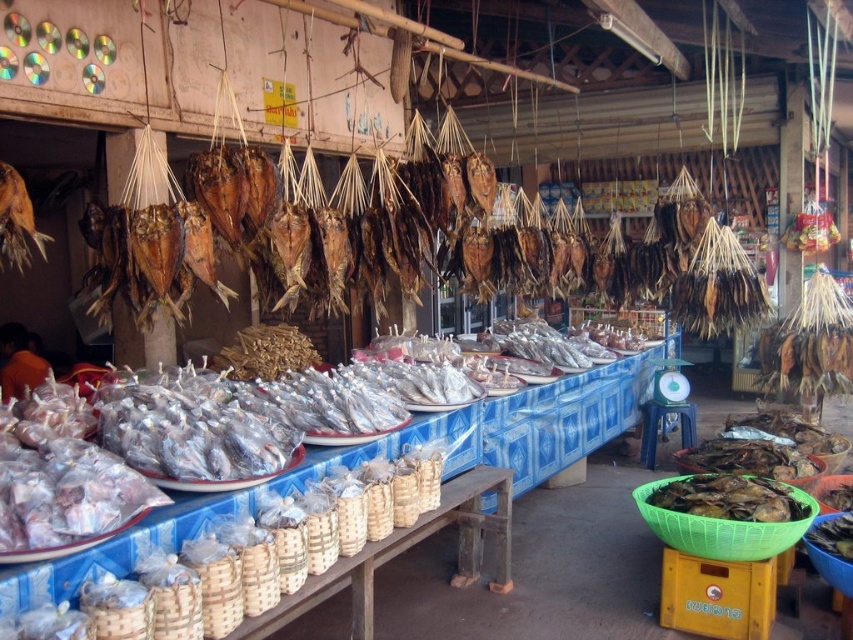
Question: Which point is farther to the camera?

Choices:
 (A) brown dried fish at center
 (B) blue woven baskets at center
 (C) green woven basket at lower right

Answer: (B)

Question: Does brown dried fish at center appear on the right side of blue woven baskets at center?

Choices:
 (A) no
 (B) yes

Answer: (A)

Question: Is blue woven baskets at center smaller than green woven basket at lower right?

Choices:
 (A) yes
 (B) no

Answer: (B)

Question: Which object is positioned closest to the blue woven baskets at center?

Choices:
 (A) green woven basket at lower right
 (B) brown dried fish at center
 (C) brown matte dried fish at lower right

Answer: (B)

Question: Does brown matte dried fish at lower right have a lesser width compared to green woven basket at lower right?

Choices:
 (A) no
 (B) yes

Answer: (A)

Question: Which object appears farthest from the camera in this image?

Choices:
 (A) brown matte dried fish at lower right
 (B) green woven basket at lower right
 (C) brown dried fish at center

Answer: (B)